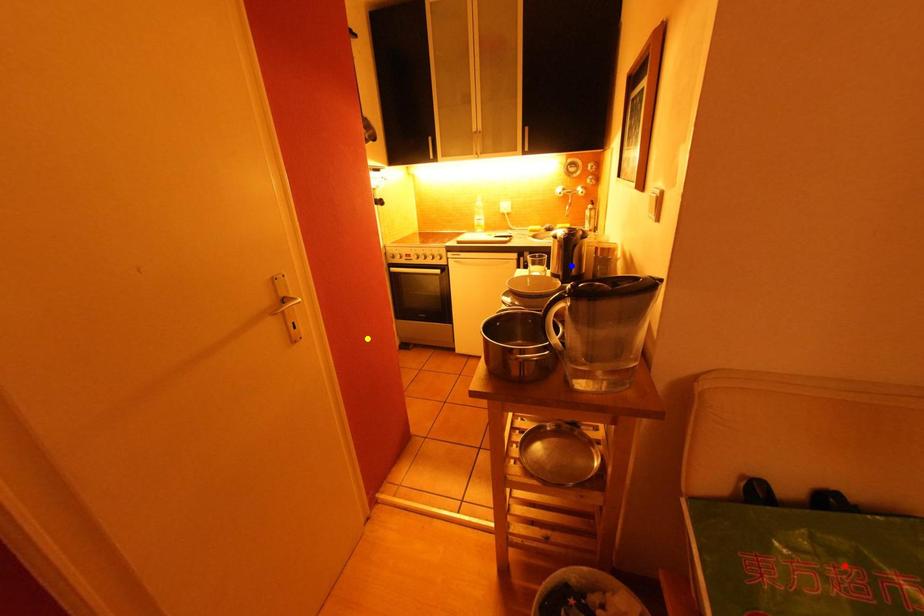
Order these from farthest to nearest:
- yellow point
- red point
- blue point

yellow point
blue point
red point